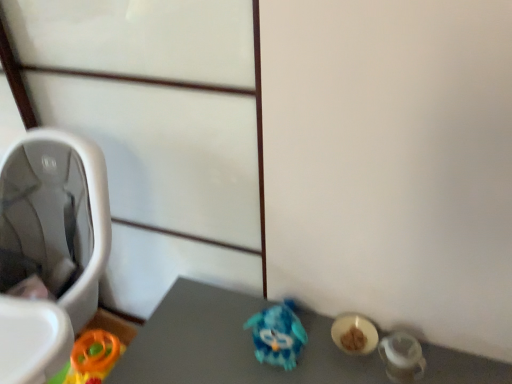
Question: Does blue shiny toy at center lie behind blue plastic toy at center?

Choices:
 (A) no
 (B) yes

Answer: (A)

Question: From a real-world perspective, is blue shiny toy at center beneath blue plastic toy at center?

Choices:
 (A) yes
 (B) no

Answer: (A)

Question: Does blue shiny toy at center have a greater width compared to blue plastic toy at center?

Choices:
 (A) yes
 (B) no

Answer: (A)

Question: Considering the relative sizes of blue shiny toy at center and blue plastic toy at center in the image provided, is blue shiny toy at center thinner than blue plastic toy at center?

Choices:
 (A) yes
 (B) no

Answer: (B)

Question: Is blue shiny toy at center to the right of blue plastic toy at center from the viewer's perspective?

Choices:
 (A) no
 (B) yes

Answer: (B)

Question: Does blue shiny toy at center have a smaller size compared to blue plastic toy at center?

Choices:
 (A) yes
 (B) no

Answer: (B)

Question: Is white plastic baby carriage at left facing towards blue shiny toy at center?

Choices:
 (A) yes
 (B) no

Answer: (B)

Question: Can you confirm if white plastic baby carriage at left is wider than blue shiny toy at center?

Choices:
 (A) no
 (B) yes

Answer: (B)

Question: Does white plastic baby carriage at left have a larger size compared to blue shiny toy at center?

Choices:
 (A) yes
 (B) no

Answer: (A)

Question: Does white plastic baby carriage at left have a greater height compared to blue shiny toy at center?

Choices:
 (A) no
 (B) yes

Answer: (B)

Question: From a real-world perspective, is white plastic baby carriage at left under blue shiny toy at center?

Choices:
 (A) yes
 (B) no

Answer: (B)

Question: Is white plastic baby carriage at left beside blue shiny toy at center?

Choices:
 (A) no
 (B) yes

Answer: (A)

Question: Is blue plastic toy at center positioned far away from white plastic baby carriage at left?

Choices:
 (A) yes
 (B) no

Answer: (B)